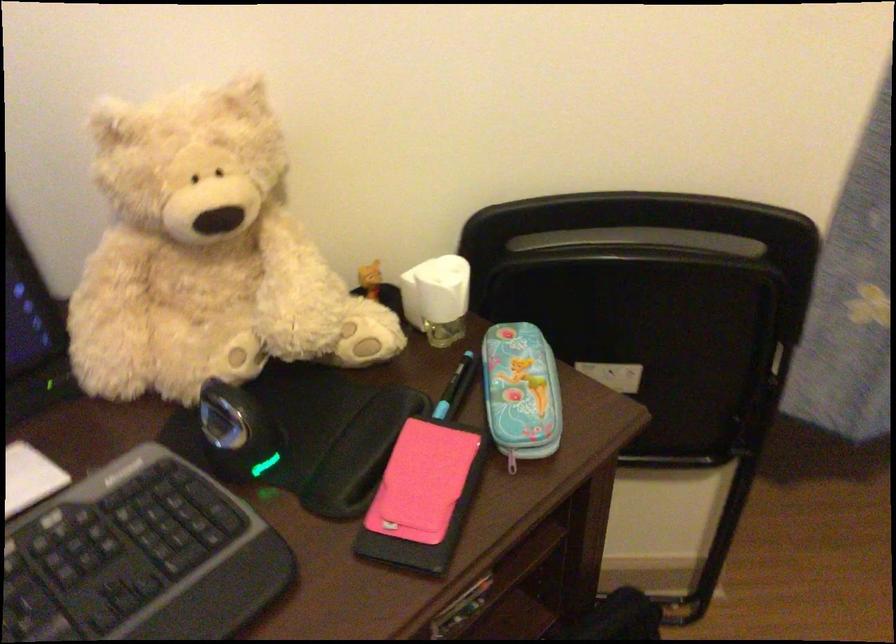
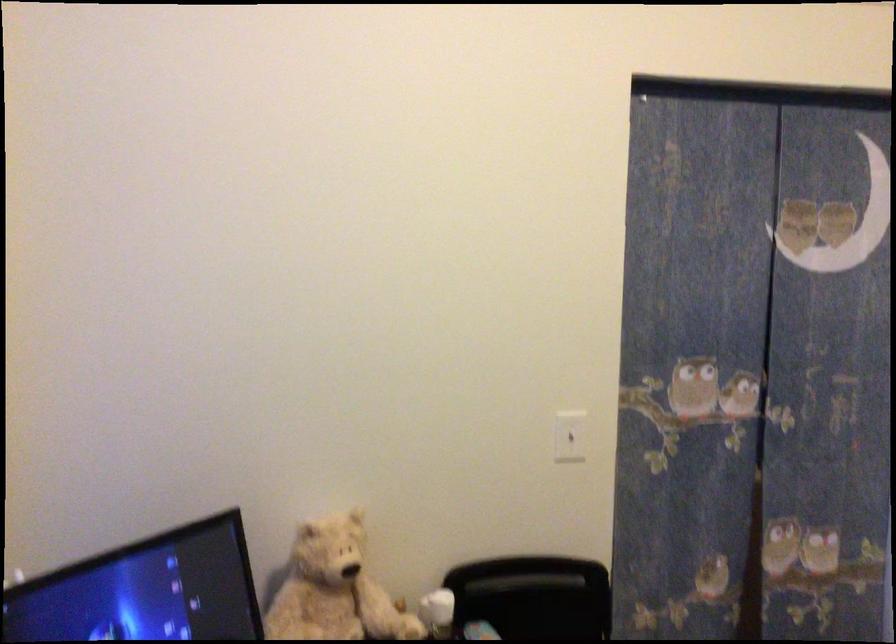
Locate, in the second image, the point that corresponds to pixel 440 292 in the first image.

(437, 612)